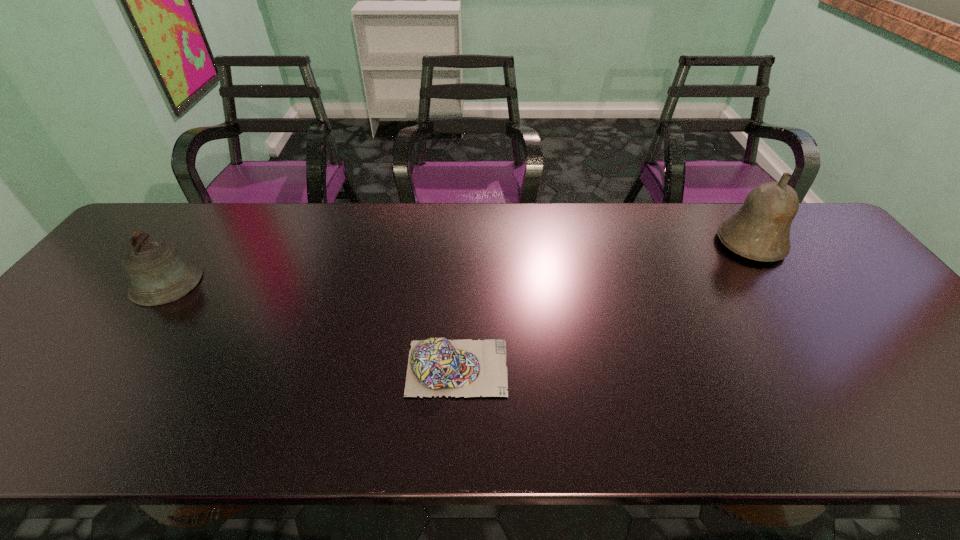
The image size is (960, 540). What are the coordinates of `unoccupied position between the shortest object and the right bell` in the screenshot? It's located at (604, 306).

You are a GUI agent. You are given a task and a screenshot of the screen. Output one action in this format:
    pyautogui.click(x=<x>, y=<y>)
    Task: Click on the vacant area that lies between the nearest object and the left bell
    The image size is (960, 540).
    Given the screenshot: What is the action you would take?
    pyautogui.click(x=312, y=325)

At what (x,y) coordinates should I click in order to perform the action: click on empty space that is in between the shorter bell and the nearest object. Please return your answer as a coordinate pair (x, y). This screenshot has height=540, width=960. Looking at the image, I should click on (312, 325).

Find the location of a particular element. free point between the second object from left to right and the second tallest object is located at coordinates (312, 325).

Where is `free spot between the taller bell and the shorter bell`? free spot between the taller bell and the shorter bell is located at coordinates (459, 262).

The image size is (960, 540). Identify the location of vacant region between the cap and the left bell. (312, 325).

In order to click on vacant area that lies between the shortest object and the rightmost object in this screenshot , I will do `click(604, 306)`.

Find the location of `free space between the second object from right to left and the tallest object`. free space between the second object from right to left and the tallest object is located at coordinates (604, 306).

Select which object is the second closest to the left bell. Please provide its 2D coordinates. Your answer should be formatted as a tuple, i.e. [(x, y)], where the tuple contains the x and y coordinates of a point satisfying the conditions above.

[(760, 230)]

Locate which object is the second closest to the shorter bell. Please provide its 2D coordinates. Your answer should be formatted as a tuple, i.e. [(x, y)], where the tuple contains the x and y coordinates of a point satisfying the conditions above.

[(760, 230)]